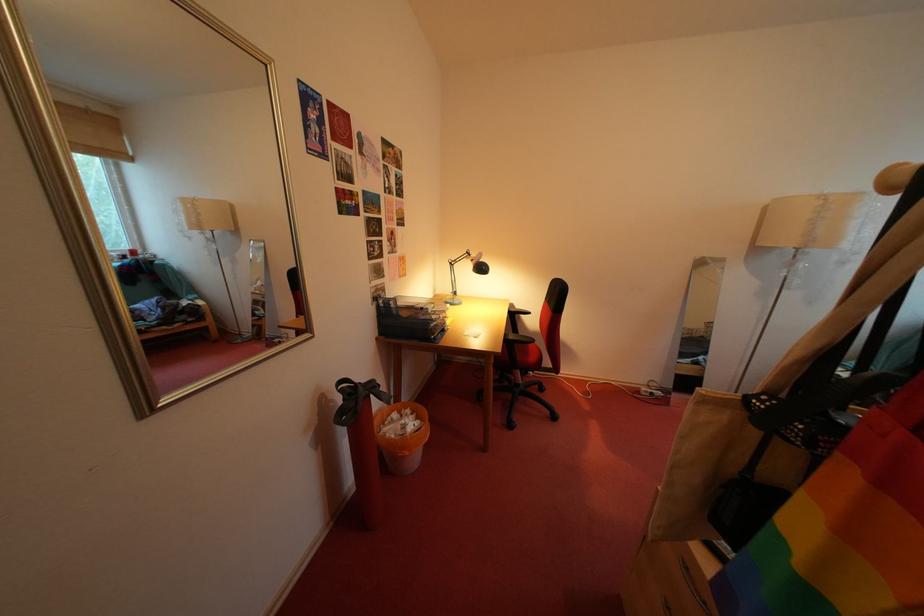
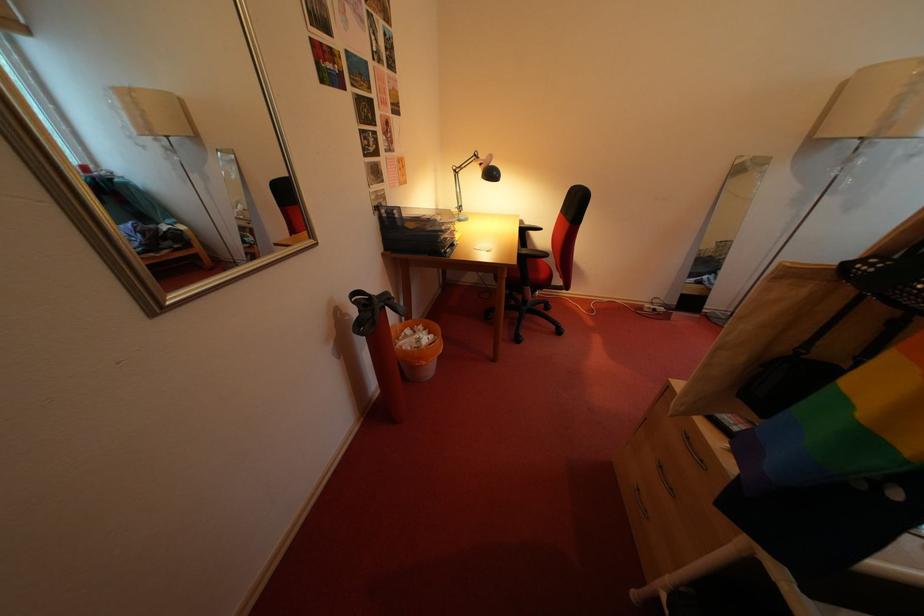
The point at (x=382, y=392) is marked in the first image. Where is the corresponding point in the second image?

(395, 304)